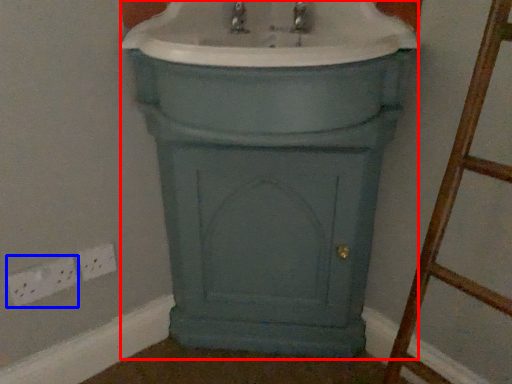
Question: Which of the following is the closest to the observer, porcelain (highlighted by a red box) or electric outlet (highlighted by a blue box)?

Choices:
 (A) porcelain
 (B) electric outlet

Answer: (A)